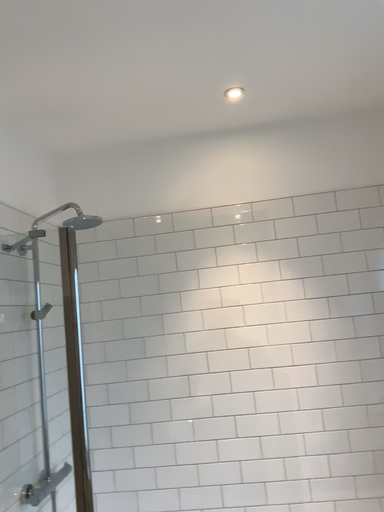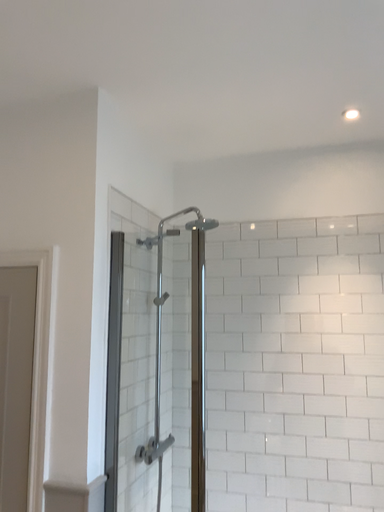
Question: How did the camera likely rotate when shooting the video?

Choices:
 (A) rotated right
 (B) rotated left

Answer: (B)